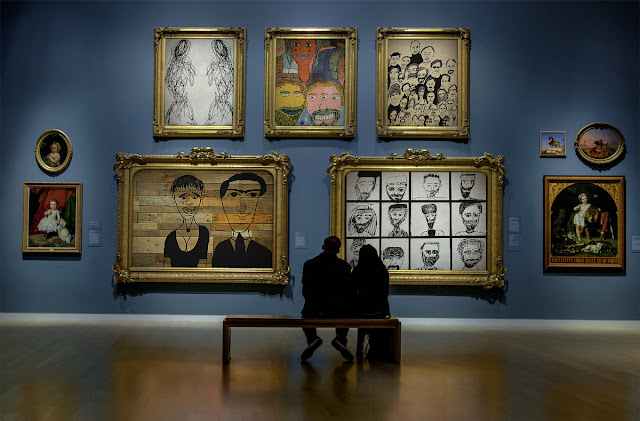
Image resolution: width=640 pixels, height=421 pixels. I want to click on wall, so click(513, 92).